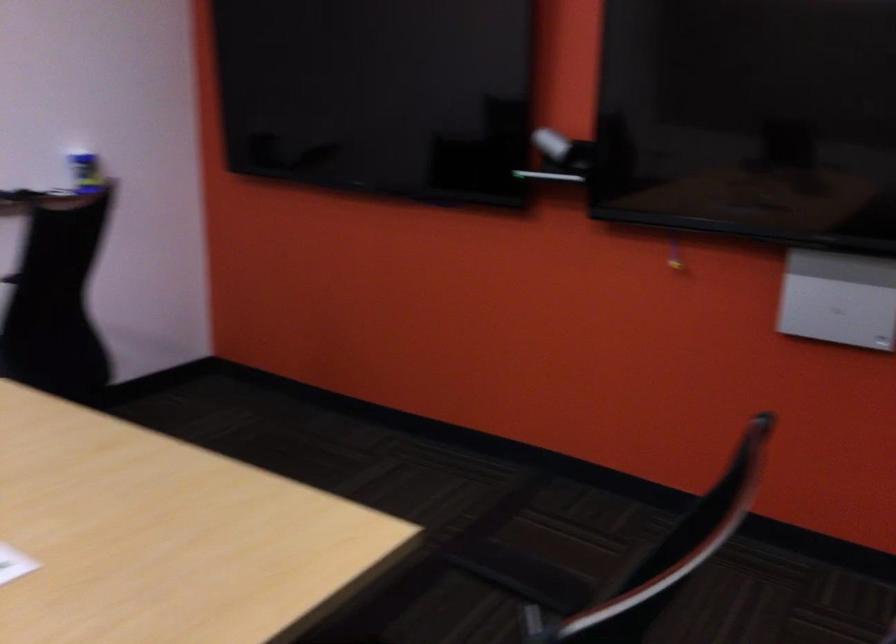
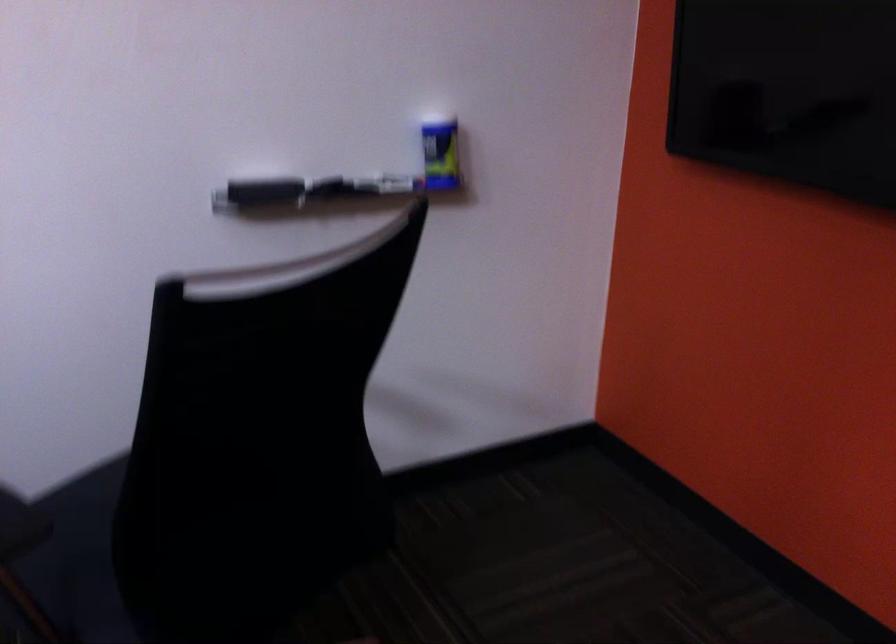
Locate, in the second image, the point that corresponds to point 97,158 in the first image.

(440, 156)